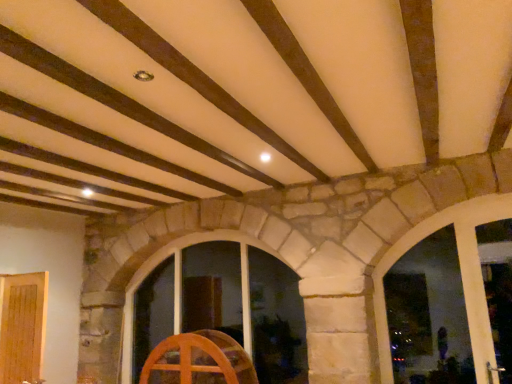
Question: Considering the relative sizes of wooden window at center, which is counted as the second window, starting from the right, and wooden wheel at center in the image provided, is wooden window at center, which is counted as the second window, starting from the right, smaller than wooden wheel at center?

Choices:
 (A) no
 (B) yes

Answer: (A)

Question: Is wooden window at center, which is counted as the second window, starting from the right, at the left side of wooden wheel at center?

Choices:
 (A) no
 (B) yes

Answer: (A)

Question: Is wooden window at center, acting as the second window starting from the front, positioned before wooden wheel at center?

Choices:
 (A) no
 (B) yes

Answer: (A)

Question: Is wooden window at center, the 1th window positioned from the back, thinner than wooden wheel at center?

Choices:
 (A) yes
 (B) no

Answer: (B)

Question: Does wooden window at center, the 1th window positioned from the back, have a greater height compared to wooden wheel at center?

Choices:
 (A) yes
 (B) no

Answer: (A)

Question: From a real-world perspective, is wooden window at center, which is the first window from left to right, positioned over wooden wheel at center based on gravity?

Choices:
 (A) yes
 (B) no

Answer: (A)

Question: Considering the relative sizes of transparent glass window at center, marked as the 2th window in a back-to-front arrangement, and wooden wheel at center in the image provided, is transparent glass window at center, marked as the 2th window in a back-to-front arrangement, shorter than wooden wheel at center?

Choices:
 (A) yes
 (B) no

Answer: (B)

Question: Is transparent glass window at center, which is counted as the second window, starting from the left, outside of wooden wheel at center?

Choices:
 (A) no
 (B) yes

Answer: (B)

Question: Can you confirm if transparent glass window at center, which is counted as the second window, starting from the left, is wider than wooden wheel at center?

Choices:
 (A) yes
 (B) no

Answer: (B)

Question: Could you tell me if transparent glass window at center, marked as the 2th window in a back-to-front arrangement, is facing wooden wheel at center?

Choices:
 (A) yes
 (B) no

Answer: (B)

Question: From the image's perspective, would you say transparent glass window at center, which is counted as the second window, starting from the left, is positioned over wooden wheel at center?

Choices:
 (A) no
 (B) yes

Answer: (B)

Question: Can you confirm if transparent glass window at center, marked as the 2th window in a back-to-front arrangement, is positioned to the left of wooden wheel at center?

Choices:
 (A) no
 (B) yes

Answer: (A)

Question: Considering the relative positions of wooden window at center, which is counted as the second window, starting from the right, and transparent glass window at center, marked as the 2th window in a back-to-front arrangement, in the image provided, is wooden window at center, which is counted as the second window, starting from the right, in front of transparent glass window at center, marked as the 2th window in a back-to-front arrangement,?

Choices:
 (A) no
 (B) yes

Answer: (A)